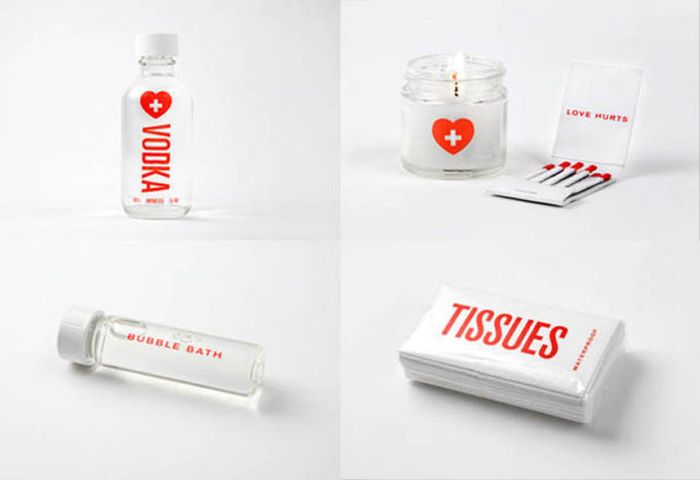
Locate an element on the screen. The height and width of the screenshot is (480, 700). tissues is located at coordinates (542, 403).